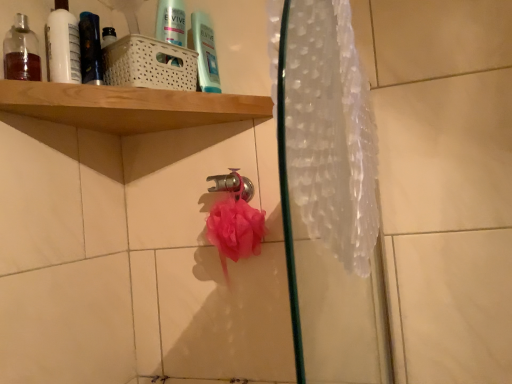
Question: Can you confirm if metallic silver faucet at center is bigger than shiny black bottle at upper left?

Choices:
 (A) no
 (B) yes

Answer: (A)

Question: From a real-world perspective, is metallic silver faucet at center physically above shiny black bottle at upper left?

Choices:
 (A) yes
 (B) no

Answer: (B)

Question: Would you consider metallic silver faucet at center to be distant from shiny black bottle at upper left?

Choices:
 (A) yes
 (B) no

Answer: (B)

Question: Considering the relative sizes of metallic silver faucet at center and shiny black bottle at upper left in the image provided, is metallic silver faucet at center taller than shiny black bottle at upper left?

Choices:
 (A) yes
 (B) no

Answer: (B)

Question: Does metallic silver faucet at center lie behind shiny black bottle at upper left?

Choices:
 (A) yes
 (B) no

Answer: (A)

Question: From the image's perspective, is metallic silver faucet at center below shiny black bottle at upper left?

Choices:
 (A) yes
 (B) no

Answer: (A)

Question: Is shiny black bottle at upper left oriented away from translucent plastic shower curtain at right?

Choices:
 (A) yes
 (B) no

Answer: (B)

Question: Can you confirm if shiny black bottle at upper left is positioned to the left of translucent plastic shower curtain at right?

Choices:
 (A) yes
 (B) no

Answer: (A)

Question: Is shiny black bottle at upper left positioned far away from translucent plastic shower curtain at right?

Choices:
 (A) yes
 (B) no

Answer: (B)

Question: From the image's perspective, is shiny black bottle at upper left on translucent plastic shower curtain at right?

Choices:
 (A) no
 (B) yes

Answer: (B)

Question: Is shiny black bottle at upper left closer to camera compared to translucent plastic shower curtain at right?

Choices:
 (A) no
 (B) yes

Answer: (A)

Question: Does shiny black bottle at upper left turn towards translucent plastic shower curtain at right?

Choices:
 (A) no
 (B) yes

Answer: (A)

Question: From a real-world perspective, is shiny black bottle at upper left below wooden shelf at upper left?

Choices:
 (A) no
 (B) yes

Answer: (A)